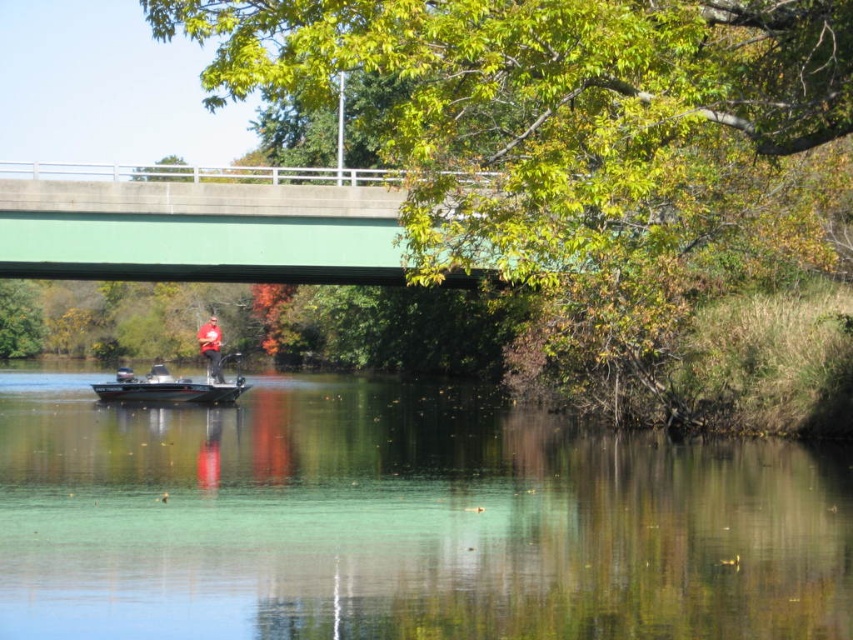
You are a photographer trying to capture the reflection of the clear water at center and the red matte shirt at center in your shot. Which object will have a larger reflection in the photo?

The red matte shirt at center will have a larger reflection in the photo because it is larger than the clear water at center.

You are standing at the riverside and want to walk towards the two points marked in the image. Which point, point (291, 385) or point (346, 182), will you reach first?

You will reach point (291, 385) first because it is closer to you than point (346, 182), which is further away.

You are an environmental scientist assessing water coverage in the image. Based on the scene, which object takes up more area in the image between the clear water at center and the green concrete bridge at upper center?

The green concrete bridge at upper center occupies more area in the image than the clear water at center because the clear water at center occupies less space than green concrete bridge at upper center.